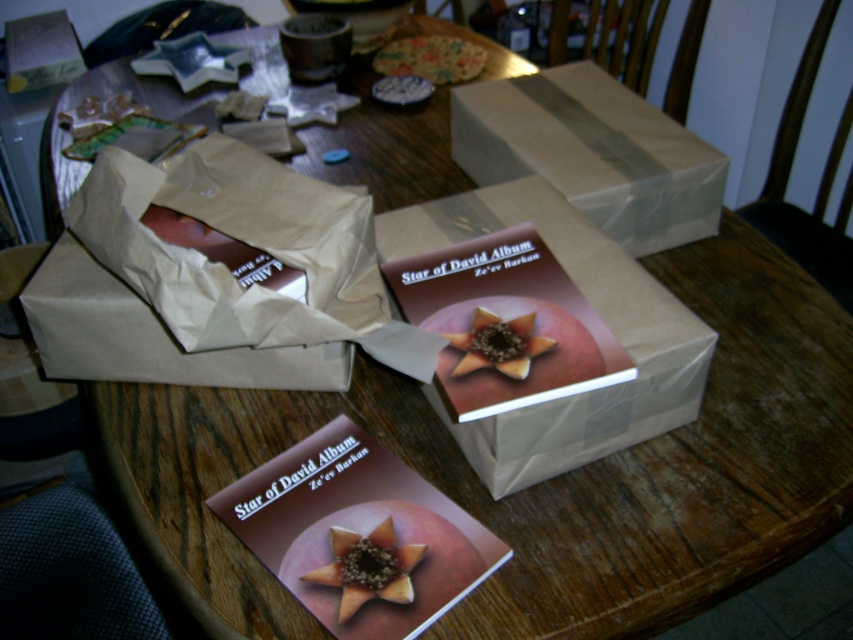
You are organizing a gift display on the wooden table and need to place the matte brown book at center and the matte brown flower at center. According to the scene, which item is located to the left of the other?

The matte brown flower at center is located to the left of the matte brown book at center because the book is on the right side of the flower.

You are standing in front of the table with the wrapped items. You notice two points marked on the table. Which point is closer to you, point (492, 484) or point (477, 333)?

Point (492, 484) is closer to the viewer than point (477, 333).

You are organizing the items on the wooden table and need to place a new item between the brown paper bag at center and the matte brown book at center. Which item should you move first to create space?

The brown paper bag at center is closer to you than the matte brown book at center, so you should move the brown paper bag at center first to create space.